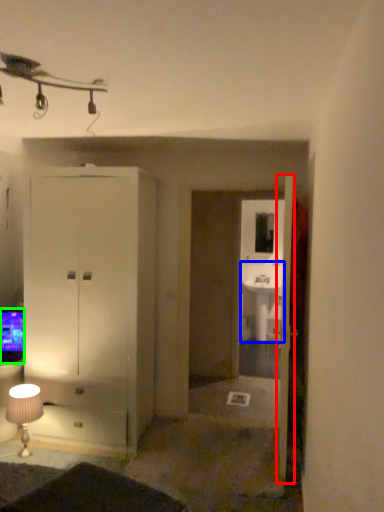
Question: Which is farther away from door (highlighted by a red box)? sink (highlighted by a blue box) or television (highlighted by a green box)?

Choices:
 (A) sink
 (B) television

Answer: (A)